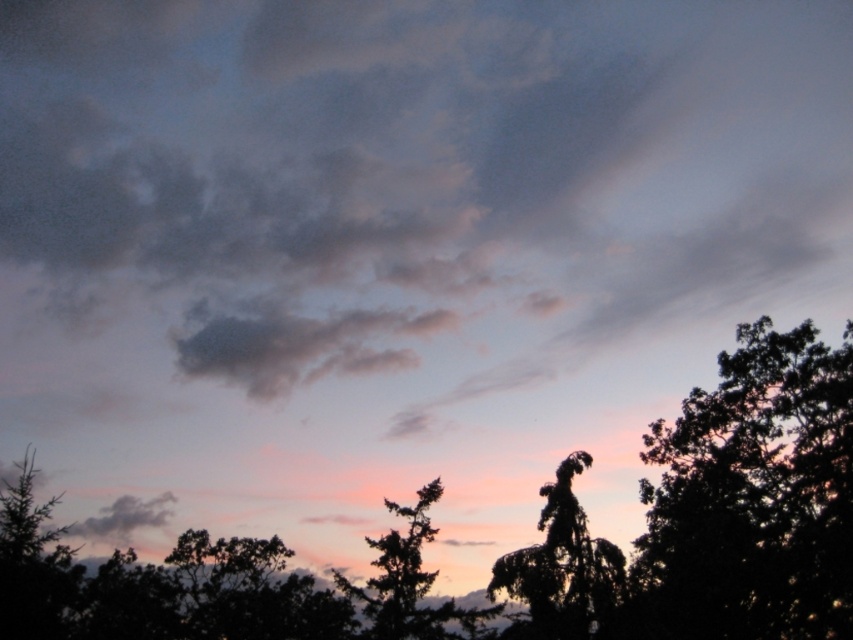
Question: Based on their relative distances, which object is nearer to the silhouette tree at left?

Choices:
 (A) silhouette tree at center
 (B) dark green leafy tree at lower right
 (C) silhouette pine tree at center
 (D) dark green leafy tree at right

Answer: (C)

Question: Does silhouette tree at left appear on the right side of silhouette pine tree at center?

Choices:
 (A) no
 (B) yes

Answer: (A)

Question: Which point is closer to the camera?

Choices:
 (A) silhouette pine tree at center
 (B) silhouette tree at left
 (C) dark green leafy tree at right

Answer: (B)

Question: Among these objects, which one is nearest to the camera?

Choices:
 (A) silhouette pine tree at center
 (B) dark green leafy tree at right

Answer: (A)

Question: Is dark green leafy tree at right to the right of silhouette tree at left from the viewer's perspective?

Choices:
 (A) yes
 (B) no

Answer: (A)

Question: Does silhouette tree at center lie behind silhouette pine tree at center?

Choices:
 (A) yes
 (B) no

Answer: (B)